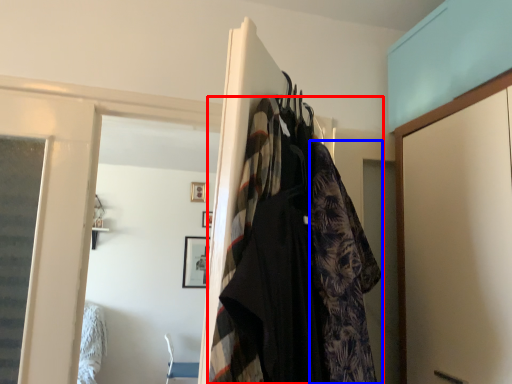
Question: Which point is further to the camera, fancy dress (highlighted by a red box) or clothing (highlighted by a blue box)?

Choices:
 (A) fancy dress
 (B) clothing

Answer: (B)